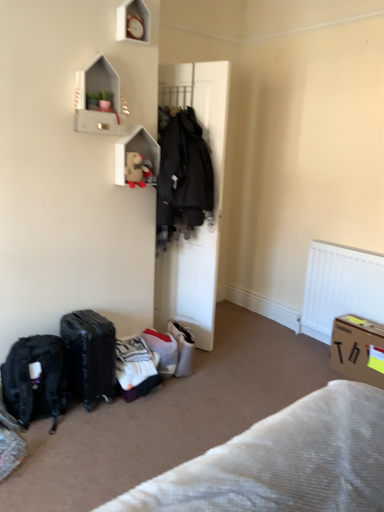
This screenshot has width=384, height=512. What are the coordinates of `vacant area located to the right-hand side of black matte backpack at lower left` in the screenshot? It's located at (97, 431).